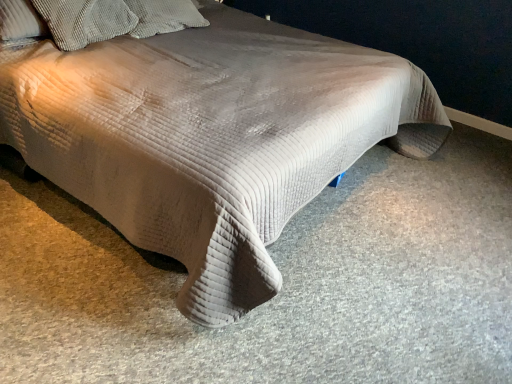
What do you see at coordinates (164, 16) in the screenshot?
I see `textured corduroy pillow at upper left, which ranks as the 2th pillow in left-to-right order` at bounding box center [164, 16].

Locate an element on the screen. This screenshot has height=384, width=512. textured corduroy pillow at upper left, which ranks as the first pillow in right-to-left order is located at coordinates (164, 16).

You are a GUI agent. You are given a task and a screenshot of the screen. Output one action in this format:
    pyautogui.click(x=<x>, y=<y>)
    Task: Click on the corduroy pillow at upper left, which appears as the 1th pillow when viewed from the left
    
    Given the screenshot: What is the action you would take?
    pyautogui.click(x=85, y=21)

What do you see at coordinates (85, 21) in the screenshot? The image size is (512, 384). I see `corduroy pillow at upper left, which is the second pillow in right-to-left order` at bounding box center [85, 21].

How much space does corduroy pillow at upper left, which is the second pillow in right-to-left order, occupy horizontally?

The width of corduroy pillow at upper left, which is the second pillow in right-to-left order, is 15.82 inches.

Find the location of a particular element. This screenshot has width=512, height=384. textured corduroy pillow at upper left, which ranks as the first pillow in right-to-left order is located at coordinates (164, 16).

Can you confirm if textured corduroy pillow at upper left, which ranks as the first pillow in right-to-left order, is positioned to the right of corduroy pillow at upper left, which is the second pillow in right-to-left order?

Correct, you'll find textured corduroy pillow at upper left, which ranks as the first pillow in right-to-left order, to the right of corduroy pillow at upper left, which is the second pillow in right-to-left order.

Considering the positions of objects textured corduroy pillow at upper left, which ranks as the 2th pillow in left-to-right order, and corduroy pillow at upper left, which is the second pillow in right-to-left order, in the image provided, who is behind, textured corduroy pillow at upper left, which ranks as the 2th pillow in left-to-right order, or corduroy pillow at upper left, which is the second pillow in right-to-left order,?

textured corduroy pillow at upper left, which ranks as the 2th pillow in left-to-right order.

Does point (144, 27) lie behind point (95, 34)?

That is True.

From the image's perspective, is textured corduroy pillow at upper left, which ranks as the first pillow in right-to-left order, located above or below corduroy pillow at upper left, which is the second pillow in right-to-left order?

Based on their image positions, textured corduroy pillow at upper left, which ranks as the first pillow in right-to-left order, is located above corduroy pillow at upper left, which is the second pillow in right-to-left order.

From a real-world perspective, is textured corduroy pillow at upper left, which ranks as the 2th pillow in left-to-right order, physically below corduroy pillow at upper left, which is the second pillow in right-to-left order?

Correct, in the physical world, textured corduroy pillow at upper left, which ranks as the 2th pillow in left-to-right order, is lower than corduroy pillow at upper left, which is the second pillow in right-to-left order.

Can you confirm if textured corduroy pillow at upper left, which ranks as the first pillow in right-to-left order, is thinner than corduroy pillow at upper left, which appears as the 1th pillow when viewed from the left?

No, textured corduroy pillow at upper left, which ranks as the first pillow in right-to-left order, is not thinner than corduroy pillow at upper left, which appears as the 1th pillow when viewed from the left.

Considering the sizes of objects textured corduroy pillow at upper left, which ranks as the 2th pillow in left-to-right order, and corduroy pillow at upper left, which appears as the 1th pillow when viewed from the left, in the image provided, who is taller, textured corduroy pillow at upper left, which ranks as the 2th pillow in left-to-right order, or corduroy pillow at upper left, which appears as the 1th pillow when viewed from the left,?

Standing taller between the two is corduroy pillow at upper left, which appears as the 1th pillow when viewed from the left.

Considering the sizes of objects textured corduroy pillow at upper left, which ranks as the first pillow in right-to-left order, and corduroy pillow at upper left, which is the second pillow in right-to-left order, in the image provided, who is bigger, textured corduroy pillow at upper left, which ranks as the first pillow in right-to-left order, or corduroy pillow at upper left, which is the second pillow in right-to-left order,?

corduroy pillow at upper left, which is the second pillow in right-to-left order.

Is textured corduroy pillow at upper left, which ranks as the first pillow in right-to-left order, inside the boundaries of corduroy pillow at upper left, which is the second pillow in right-to-left order, or outside?

The correct answer is: outside.

Is textured corduroy pillow at upper left, which ranks as the 2th pillow in left-to-right order, far from corduroy pillow at upper left, which appears as the 1th pillow when viewed from the left?

textured corduroy pillow at upper left, which ranks as the 2th pillow in left-to-right order, is actually quite close to corduroy pillow at upper left, which appears as the 1th pillow when viewed from the left.

Is corduroy pillow at upper left, which appears as the 1th pillow when viewed from the left, at the back of textured corduroy pillow at upper left, which ranks as the 2th pillow in left-to-right order?

No, corduroy pillow at upper left, which appears as the 1th pillow when viewed from the left, is not at the back of textured corduroy pillow at upper left, which ranks as the 2th pillow in left-to-right order.

How different are the orientations of textured corduroy pillow at upper left, which ranks as the first pillow in right-to-left order, and corduroy pillow at upper left, which is the second pillow in right-to-left order, in degrees?

They differ by 22.5 degrees in their facing directions.

You are a GUI agent. You are given a task and a screenshot of the screen. Output one action in this format:
    pyautogui.click(x=<x>, y=<y>)
    Task: Click on the pillow below the corduroy pillow at upper left, which appears as the 1th pillow when viewed from the left (from a real-world perspective)
    Image resolution: width=512 pixels, height=384 pixels.
    Given the screenshot: What is the action you would take?
    pyautogui.click(x=164, y=16)

Can you confirm if corduroy pillow at upper left, which is the second pillow in right-to-left order, is positioned to the left of textured corduroy pillow at upper left, which ranks as the 2th pillow in left-to-right order?

Yes.

Which object is closer to the camera taking this photo, corduroy pillow at upper left, which appears as the 1th pillow when viewed from the left, or textured corduroy pillow at upper left, which ranks as the 2th pillow in left-to-right order?

corduroy pillow at upper left, which appears as the 1th pillow when viewed from the left, is more forward.

Does point (68, 9) come behind point (181, 26)?

No, (68, 9) is closer to viewer.

From the image's perspective, does corduroy pillow at upper left, which appears as the 1th pillow when viewed from the left, appear lower than textured corduroy pillow at upper left, which ranks as the first pillow in right-to-left order?

Yes, from the image's perspective, corduroy pillow at upper left, which appears as the 1th pillow when viewed from the left, is below textured corduroy pillow at upper left, which ranks as the first pillow in right-to-left order.

From a real-world perspective, is corduroy pillow at upper left, which appears as the 1th pillow when viewed from the left, physically located above or below textured corduroy pillow at upper left, which ranks as the 2th pillow in left-to-right order?

From a real-world perspective, corduroy pillow at upper left, which appears as the 1th pillow when viewed from the left, is physically above textured corduroy pillow at upper left, which ranks as the 2th pillow in left-to-right order.

Is corduroy pillow at upper left, which is the second pillow in right-to-left order, wider or thinner than textured corduroy pillow at upper left, which ranks as the first pillow in right-to-left order?

Clearly, corduroy pillow at upper left, which is the second pillow in right-to-left order, has less width compared to textured corduroy pillow at upper left, which ranks as the first pillow in right-to-left order.

Does corduroy pillow at upper left, which appears as the 1th pillow when viewed from the left, have a lesser height compared to textured corduroy pillow at upper left, which ranks as the first pillow in right-to-left order?

No, corduroy pillow at upper left, which appears as the 1th pillow when viewed from the left, is not shorter than textured corduroy pillow at upper left, which ranks as the first pillow in right-to-left order.

Can you confirm if corduroy pillow at upper left, which is the second pillow in right-to-left order, is bigger than textured corduroy pillow at upper left, which ranks as the first pillow in right-to-left order?

Indeed, corduroy pillow at upper left, which is the second pillow in right-to-left order, has a larger size compared to textured corduroy pillow at upper left, which ranks as the first pillow in right-to-left order.

Is textured corduroy pillow at upper left, which ranks as the 2th pillow in left-to-right order, a part of corduroy pillow at upper left, which is the second pillow in right-to-left order?

No, textured corduroy pillow at upper left, which ranks as the 2th pillow in left-to-right order, is not a part of corduroy pillow at upper left, which is the second pillow in right-to-left order.

Would you consider corduroy pillow at upper left, which is the second pillow in right-to-left order, to be distant from textured corduroy pillow at upper left, which ranks as the 2th pillow in left-to-right order?

Actually, corduroy pillow at upper left, which is the second pillow in right-to-left order, and textured corduroy pillow at upper left, which ranks as the 2th pillow in left-to-right order, are a little close together.

Could you tell me if corduroy pillow at upper left, which appears as the 1th pillow when viewed from the left, is facing textured corduroy pillow at upper left, which ranks as the first pillow in right-to-left order?

No.

You are a GUI agent. You are given a task and a screenshot of the screen. Output one action in this format:
    pyautogui.click(x=<x>, y=<y>)
    Task: Click on the pillow lying on the right of corduroy pillow at upper left, which is the second pillow in right-to-left order
    
    Given the screenshot: What is the action you would take?
    pyautogui.click(x=164, y=16)

Identify the location of pillow lying above the corduroy pillow at upper left, which is the second pillow in right-to-left order (from the image's perspective). The width and height of the screenshot is (512, 384). (164, 16).

The height and width of the screenshot is (384, 512). In the image, there is a textured corduroy pillow at upper left, which ranks as the 2th pillow in left-to-right order. Find the location of `pillow below it (from the image's perspective)`. pillow below it (from the image's perspective) is located at coordinates (85, 21).